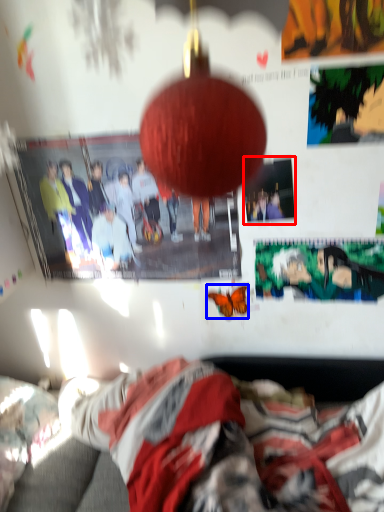
Question: Which object is closer to the camera taking this photo, poster page (highlighted by a red box) or butterfly (highlighted by a blue box)?

Choices:
 (A) poster page
 (B) butterfly

Answer: (A)